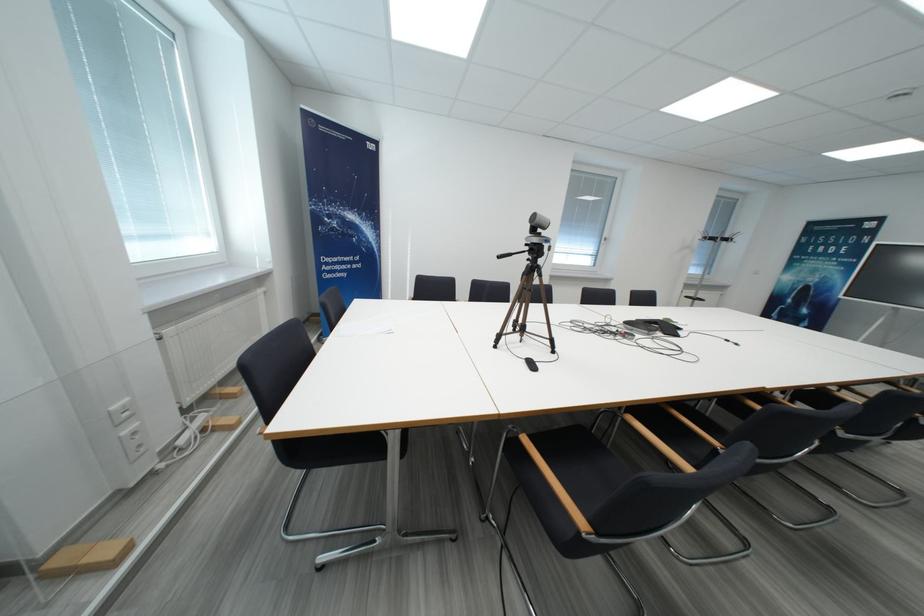
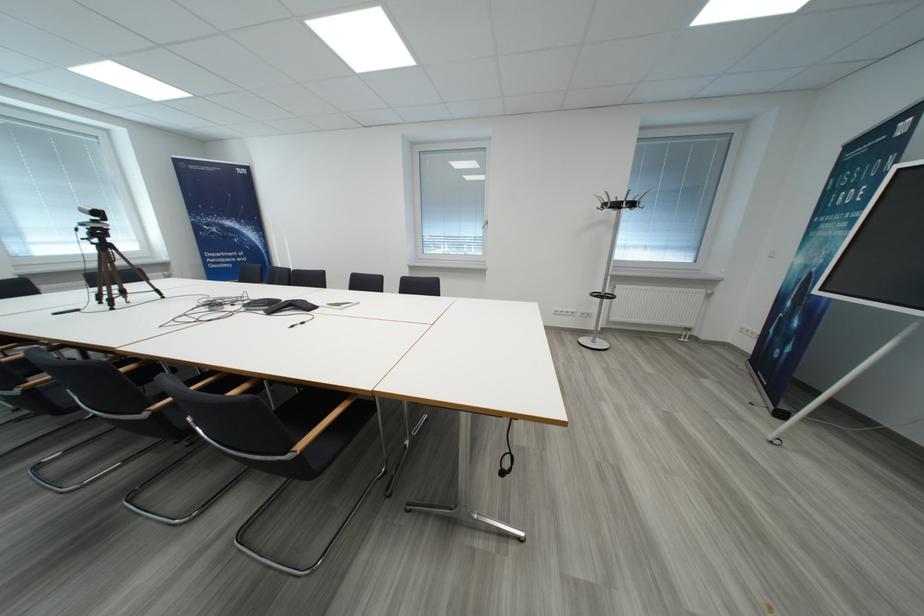
Where in the second image is the point corresponding to point 733,243 from the first image?

(623, 208)